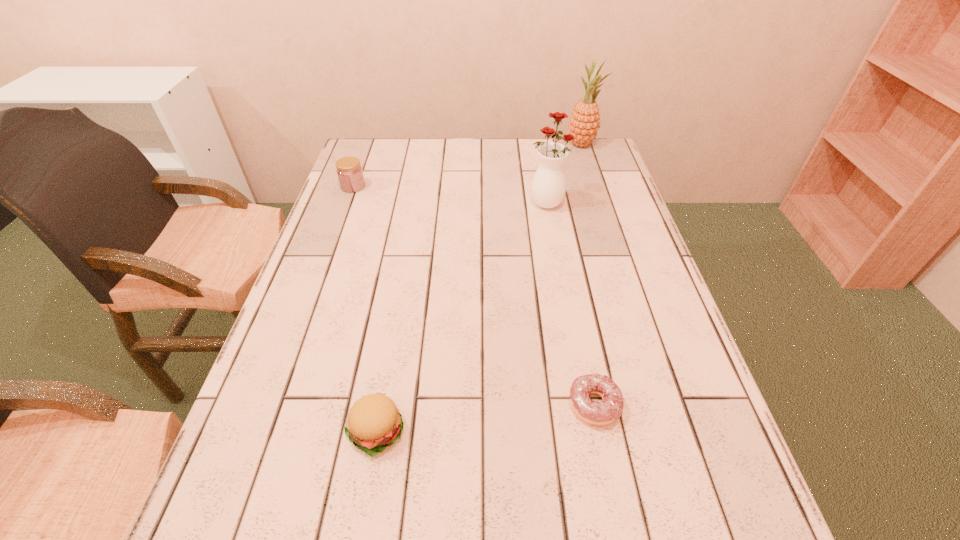
The image size is (960, 540). Find the location of `free space between the vase and the third tallest object`. free space between the vase and the third tallest object is located at coordinates (449, 194).

I want to click on unoccupied area between the second object from left to right and the jam, so click(364, 308).

Identify the location of object that is the second nearest to the fourth tallest object. (548, 188).

Locate which object is the fourth closest to the doughnut. Please provide its 2D coordinates. Your answer should be formatted as a tuple, i.e. [(x, y)], where the tuple contains the x and y coordinates of a point satisfying the conditions above.

[(584, 123)]

You are a GUI agent. You are given a task and a screenshot of the screen. Output one action in this format:
    pyautogui.click(x=<x>, y=<y>)
    Task: Click on the vacant space that satisfies the following two spatial constraints: 1. on the back side of the rightmost object; 2. on the left side of the vase
    
    Given the screenshot: What is the action you would take?
    pyautogui.click(x=536, y=145)

Locate an element on the screen. vacant point that satisfies the following two spatial constraints: 1. on the back side of the shortest object; 2. on the right side of the fourth object from right to left is located at coordinates (379, 406).

Find the location of a particular element. This screenshot has height=540, width=960. vacant space that satisfies the following two spatial constraints: 1. on the front side of the fourth tallest object; 2. on the left side of the third shortest object is located at coordinates (265, 431).